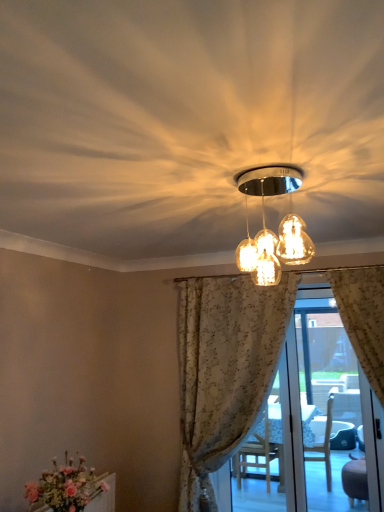
Question: Can you confirm if matte glass light fixture at center is thinner than translucent floral curtains at center?

Choices:
 (A) no
 (B) yes

Answer: (A)

Question: Does matte glass light fixture at center have a greater width compared to translucent floral curtains at center?

Choices:
 (A) yes
 (B) no

Answer: (A)

Question: Is matte glass light fixture at center facing away from translucent floral curtains at center?

Choices:
 (A) no
 (B) yes

Answer: (B)

Question: Considering the relative positions of matte glass light fixture at center and translucent floral curtains at center in the image provided, is matte glass light fixture at center to the left of translucent floral curtains at center from the viewer's perspective?

Choices:
 (A) yes
 (B) no

Answer: (A)

Question: Is matte glass light fixture at center far from translucent floral curtains at center?

Choices:
 (A) yes
 (B) no

Answer: (A)

Question: From a real-world perspective, is matte glass light fixture at center under translucent floral curtains at center?

Choices:
 (A) no
 (B) yes

Answer: (A)

Question: Does matte pink flowers at lower left lie behind floral fabric curtain at center?

Choices:
 (A) no
 (B) yes

Answer: (A)

Question: Can you confirm if matte pink flowers at lower left is shorter than floral fabric curtain at center?

Choices:
 (A) no
 (B) yes

Answer: (B)

Question: From a real-world perspective, is matte pink flowers at lower left positioned over floral fabric curtain at center based on gravity?

Choices:
 (A) no
 (B) yes

Answer: (A)

Question: Is matte pink flowers at lower left positioned with its back to floral fabric curtain at center?

Choices:
 (A) yes
 (B) no

Answer: (B)

Question: From the image's perspective, is matte pink flowers at lower left under floral fabric curtain at center?

Choices:
 (A) yes
 (B) no

Answer: (A)

Question: Is matte pink flowers at lower left directly adjacent to floral fabric curtain at center?

Choices:
 (A) no
 (B) yes

Answer: (A)

Question: Is translucent floral curtains at center to the left of matte glass light fixture at center from the viewer's perspective?

Choices:
 (A) yes
 (B) no

Answer: (B)